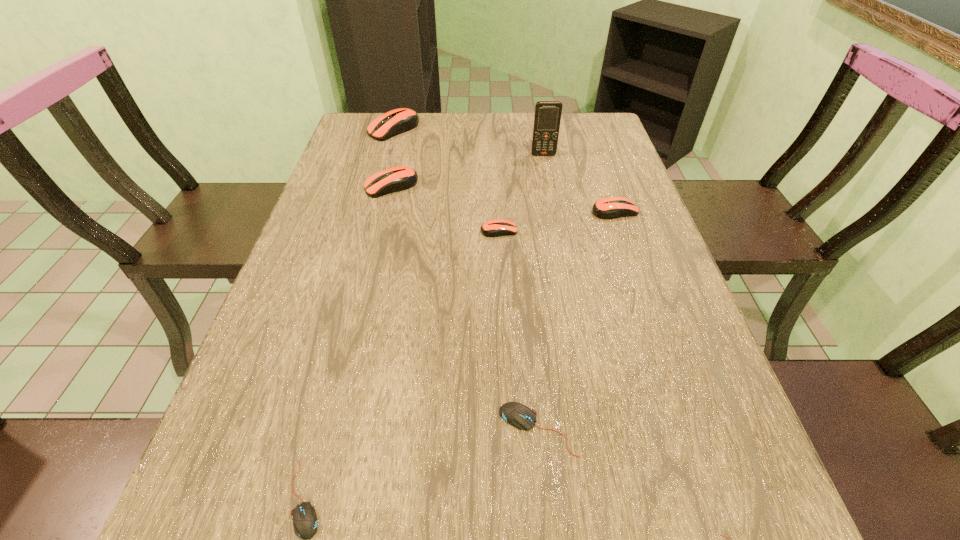
Locate an element on the screen. Image resolution: width=960 pixels, height=540 pixels. orange cellular telephone is located at coordinates (547, 118).

This screenshot has width=960, height=540. I want to click on cellular telephone, so click(547, 118).

I want to click on the biggest orange computer mouse, so click(397, 121).

You are a GUI agent. You are given a task and a screenshot of the screen. Output one action in this format:
    pyautogui.click(x=<x>, y=<y>)
    Task: Click on the seventh shortest object
    
    Given the screenshot: What is the action you would take?
    pyautogui.click(x=397, y=121)

The image size is (960, 540). Identify the location of the sixth nearest object. (399, 178).

Where is `the second biggest orange computer mouse`? This screenshot has height=540, width=960. the second biggest orange computer mouse is located at coordinates (399, 178).

You are a GUI agent. You are given a task and a screenshot of the screen. Output one action in this format:
    pyautogui.click(x=<x>, y=<y>)
    Task: Click on the rightmost orange computer mouse
    
    Given the screenshot: What is the action you would take?
    pyautogui.click(x=607, y=208)

You are a GUI agent. You are given a task and a screenshot of the screen. Output one action in this format:
    pyautogui.click(x=<x>, y=<y>)
    Task: Click on the third farthest orange computer mouse
    
    Given the screenshot: What is the action you would take?
    pyautogui.click(x=607, y=208)

Locate an element on the screen. the smallest orange computer mouse is located at coordinates (493, 228).

Where is `the fourth shortest object`? This screenshot has width=960, height=540. the fourth shortest object is located at coordinates (493, 228).